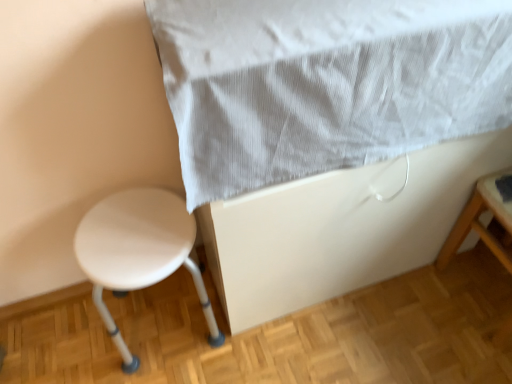
Locate an element on the screen. free point above white plastic stool at lower left (from a real-world perspective) is located at coordinates (126, 237).